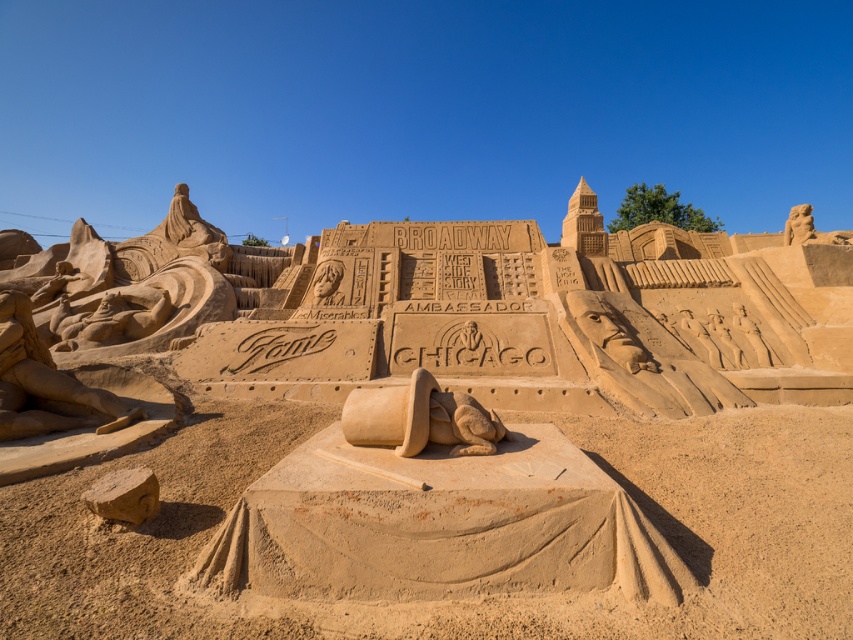
You are standing in front of the Broadway sand sculpture and want to place a small souvenir between the smooth sand at center and the smooth sand figure at left. Based on their positions, where should you place it to ensure it sits between them?

The smooth sand at center is positioned on the right side of the smooth sand figure at left, so placing the souvenir to the right of the smooth sand figure at left and to the left of the smooth sand at center would position it between them.

Based on the scene description, which object is wider, the smooth sand at center or the smooth sand figure at left?

The smooth sand at center is wider than the smooth sand figure at left according to the description.